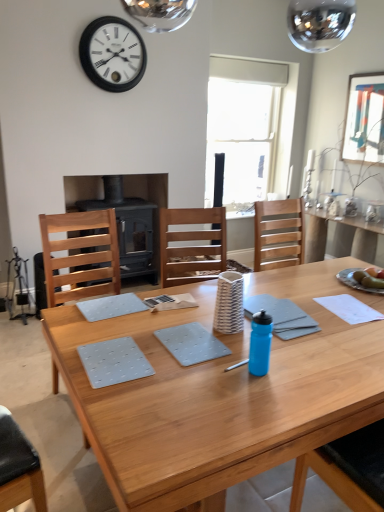
The width and height of the screenshot is (384, 512). What do you see at coordinates (79, 255) in the screenshot?
I see `light wood chair at left` at bounding box center [79, 255].

This screenshot has width=384, height=512. Describe the element at coordinates (110, 306) in the screenshot. I see `light gray fabric placemat at center, marked as the 1th place mat in a back-to-front arrangement` at that location.

What is the approximate height of wooden table at center?

wooden table at center is 30.53 inches in height.

From the picture: In order to face wooden table at center, should I rotate leftwards or rightwards?

A 12.061 degree turn to the right will do.

What do you see at coordinates (112, 54) in the screenshot?
I see `white matte wall clock at upper center` at bounding box center [112, 54].

Locate an element on the screen. The width and height of the screenshot is (384, 512). light wood chair at left is located at coordinates (79, 255).

Which is more to the left, gray matte placemat at center, acting as the 2th place mat starting from the top, or transparent glass window at center?

From the viewer's perspective, gray matte placemat at center, acting as the 2th place mat starting from the top, appears more on the left side.

Can you tell me how much gray matte placemat at center, acting as the 2th place mat starting from the top, and transparent glass window at center differ in facing direction?

4.07 degrees separate the facing orientations of gray matte placemat at center, acting as the 2th place mat starting from the top, and transparent glass window at center.

What are the coordinates of `the 2nd place mat directly beneath the transparent glass window at center (from a real-world perspective)` in the screenshot? It's located at tap(114, 362).

From their relative heights in the image, would you say gray matte placemat at center, which is the 2th place mat from back to front, is taller or shorter than transparent glass window at center?

In the image, gray matte placemat at center, which is the 2th place mat from back to front, appears to be shorter than transparent glass window at center.

In the image, is gray matte notebook at center on the left side or the right side of green matte apple at center?

From the image, it's evident that gray matte notebook at center is to the left of green matte apple at center.

From the image's perspective, does gray matte notebook at center appear lower than green matte apple at center?

Correct, gray matte notebook at center appears lower than green matte apple at center in the image.

Which of these two, gray matte notebook at center or green matte apple at center, stands taller?

green matte apple at center.

From a real-world perspective, is light gray fabric placemat at center, marked as the 1th place mat in a back-to-front arrangement, positioned above or below gray matte placemat at center, which is counted as the 1th place mat, starting from the bottom?

In terms of real-world spatial position, light gray fabric placemat at center, marked as the 1th place mat in a back-to-front arrangement, is above gray matte placemat at center, which is counted as the 1th place mat, starting from the bottom.

In terms of size, does light gray fabric placemat at center, marked as the 1th place mat in a back-to-front arrangement, appear bigger or smaller than gray matte placemat at center, which is counted as the 1th place mat, starting from the bottom?

Considering their sizes, light gray fabric placemat at center, marked as the 1th place mat in a back-to-front arrangement, takes up less space than gray matte placemat at center, which is counted as the 1th place mat, starting from the bottom.

Where is `place mat lying on the right of light gray fabric placemat at center, which appears as the 1th place mat when viewed from the top`? This screenshot has width=384, height=512. place mat lying on the right of light gray fabric placemat at center, which appears as the 1th place mat when viewed from the top is located at coordinates (114, 362).

Is light gray fabric placemat at center, which is counted as the 2th place mat, starting from the front, positioned with its back to gray matte placemat at center, which is counted as the 1th place mat, starting from the bottom?

No, gray matte placemat at center, which is counted as the 1th place mat, starting from the bottom, is not at the back of light gray fabric placemat at center, which is counted as the 2th place mat, starting from the front.

From a real-world perspective, does light wood chair at left stand above white matte wall clock at upper center?

Incorrect, from a real-world perspective, light wood chair at left is lower than white matte wall clock at upper center.

Looking at their sizes, would you say light wood chair at left is wider or thinner than white matte wall clock at upper center?

In the image, light wood chair at left appears to be wider than white matte wall clock at upper center.

Which point is more forward, (x=112, y=248) or (x=140, y=57)?

The point (x=112, y=248) is more forward.

From the picture: Is light wood chair at left to the left or to the right of white matte wall clock at upper center in the image?

light wood chair at left is positioned on white matte wall clock at upper center's right side.

Can you confirm if gray matte notebook at center is shorter than matte white picture frame at upper right?

Yes.

Which object is further away from the camera taking this photo, gray matte notebook at center or matte white picture frame at upper right?

matte white picture frame at upper right.

Considering the sizes of objects gray matte notebook at center and matte white picture frame at upper right in the image provided, who is thinner, gray matte notebook at center or matte white picture frame at upper right?

Thinner between the two is matte white picture frame at upper right.

Can you confirm if gray matte placemat at center, which is the 2th place mat from back to front, is wider than gray matte notebook at center?

Correct, the width of gray matte placemat at center, which is the 2th place mat from back to front, exceeds that of gray matte notebook at center.

Between gray matte placemat at center, acting as the 2th place mat starting from the top, and gray matte notebook at center, which one has more height?

With more height is gray matte placemat at center, acting as the 2th place mat starting from the top.

Is gray matte placemat at center, which is the 2th place mat from back to front, positioned with its back to gray matte notebook at center?

gray matte placemat at center, which is the 2th place mat from back to front, is not turned away from gray matte notebook at center.

Do you think gray matte placemat at center, which is counted as the 1th place mat, starting from the bottom, is within gray matte notebook at center, or outside of it?

The correct answer is: outside.

Find the location of a particular element. This screenshot has height=512, width=384. table below the blue plastic water bottle at center (from a real-world perspective) is located at coordinates (222, 393).

Which is more to the left, wooden table at center or blue plastic water bottle at center?

Positioned to the left is blue plastic water bottle at center.

Is the position of wooden table at center less distant than that of blue plastic water bottle at center?

Yes.

Which point is more forward, (73, 327) or (254, 338)?

Positioned in front is point (254, 338).

I want to click on window that appears behind the gray matte placemat at center, which appears as the first place mat when viewed from the front, so click(250, 128).

At what (x,y) coordinates should I click in order to perform the action: click on notebook that appears on the left of green matte apple at center. Please return your answer as a coordinate pair (x, y). This screenshot has width=384, height=512. Looking at the image, I should click on (282, 316).

Considering their positions, is blue plastic water bottle at center positioned closer to gray matte placemat at center, which is the 2th place mat from back to front, than green matte apple at center?

Among the two, blue plastic water bottle at center is located nearer to gray matte placemat at center, which is the 2th place mat from back to front.

Which object lies further to the anchor point green matte apple at center, matte white picture frame at upper right or light wood chair at left?

matte white picture frame at upper right.

Based on the photo, which object lies further to the anchor point blue plastic water bottle at center, white matte wall clock at upper center or green matte apple at center?

The object further to blue plastic water bottle at center is white matte wall clock at upper center.

Based on the photo, which object lies further to the anchor point green matte apple at center, blue plastic water bottle at center or gray matte placemat at center, acting as the 2th place mat starting from the top?

gray matte placemat at center, acting as the 2th place mat starting from the top.

Considering their positions, is blue plastic water bottle at center positioned closer to white matte wall clock at upper center than green matte apple at center?

green matte apple at center lies closer to white matte wall clock at upper center than the other object.

Considering their positions, is white matte wall clock at upper center positioned further to green matte apple at center than transparent glass window at center?

transparent glass window at center lies further to green matte apple at center than the other object.

Considering their positions, is wooden table at center positioned closer to light wood chair at left than transparent glass window at center?

wooden table at center.

Based on their spatial positions, is white matte wall clock at upper center or green matte apple at center further from matte white picture frame at upper right?

Based on the image, white matte wall clock at upper center appears to be further to matte white picture frame at upper right.

Find the location of a particular element. The height and width of the screenshot is (512, 384). notebook between white matte wall clock at upper center and gray matte placemat at center, acting as the 2th place mat starting from the top, in the up-down direction is located at coordinates (282, 316).

This screenshot has height=512, width=384. What are the coordinates of `chair between gray matte placemat at center, which is the 2th place mat from back to front, and transparent glass window at center from front to back` in the screenshot? It's located at (79, 255).

Image resolution: width=384 pixels, height=512 pixels. Find the location of `wall clock between gray matte placemat at center, acting as the 2th place mat starting from the top, and matte white picture frame at upper right in the front-back direction`. wall clock between gray matte placemat at center, acting as the 2th place mat starting from the top, and matte white picture frame at upper right in the front-back direction is located at coordinates (112, 54).

Locate an element on the screen. Image resolution: width=384 pixels, height=512 pixels. picture frame between light wood chair at left and transparent glass window at center along the z-axis is located at coordinates pos(364,119).